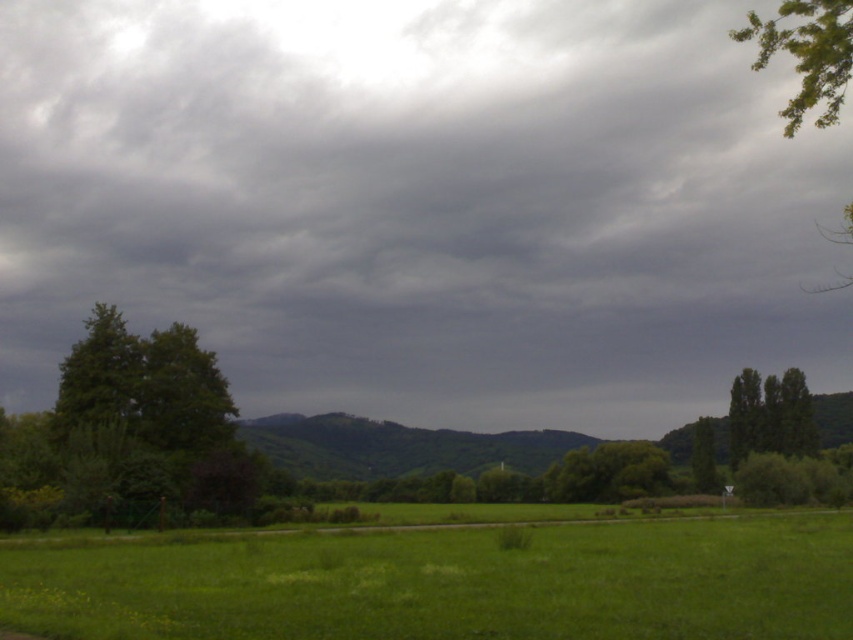
Question: Is green leafy tree at left to the left of green leafy tree at upper right from the viewer's perspective?

Choices:
 (A) yes
 (B) no

Answer: (A)

Question: Which point is farther to the camera?

Choices:
 (A) green leafy tree at upper right
 (B) green leafy tree at center
 (C) green leafy tree at left
 (D) green grass at lower center

Answer: (B)

Question: Is green leafy tree at left above green leafy tree at upper right?

Choices:
 (A) yes
 (B) no

Answer: (B)

Question: Which object is farther from the camera taking this photo?

Choices:
 (A) green leafy tree at left
 (B) green leafy tree at center
 (C) green grass at lower center
 (D) green leafy tree at upper right

Answer: (B)

Question: Can you confirm if green leafy tree at left is positioned above green leafy tree at center?

Choices:
 (A) yes
 (B) no

Answer: (A)

Question: Which of the following is the farthest from the observer?

Choices:
 (A) gray matte cloud at upper center
 (B) green grass at lower center
 (C) green leafy tree at left
 (D) green leafy tree at upper right

Answer: (A)